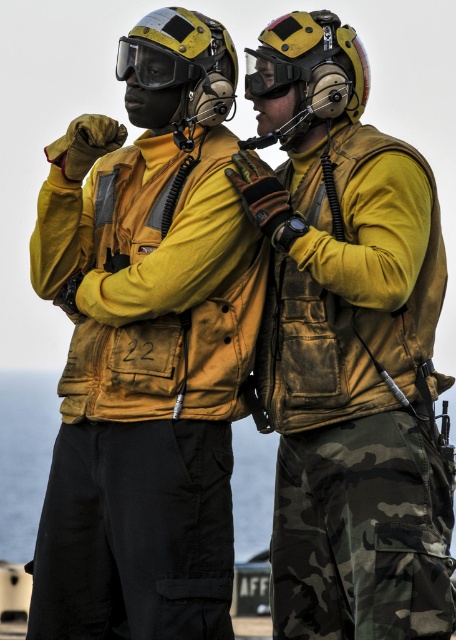
Question: Is yellow matte helmet at upper center smaller than matte yellow helmet at upper center?

Choices:
 (A) no
 (B) yes

Answer: (B)

Question: Considering the real-world distances, which object is closest to the yellow matte helmet at upper center?

Choices:
 (A) matte yellow helmet at upper center
 (B) transparent plastic goggles at upper center

Answer: (A)

Question: Can you confirm if matte yellow helmet at upper center is positioned above transparent plastic goggles at center?

Choices:
 (A) yes
 (B) no

Answer: (A)

Question: Which point is closer to the camera?

Choices:
 (A) matte yellow helmet at upper center
 (B) transparent plastic goggles at center

Answer: (A)

Question: Where is yellow matte helmet at upper center located in relation to matte yellow helmet at upper center in the image?

Choices:
 (A) right
 (B) left

Answer: (A)

Question: Which object is the closest to the transparent plastic goggles at center?

Choices:
 (A) matte yellow helmet at upper center
 (B) yellow matte helmet at upper center
 (C) transparent plastic goggles at upper center

Answer: (B)